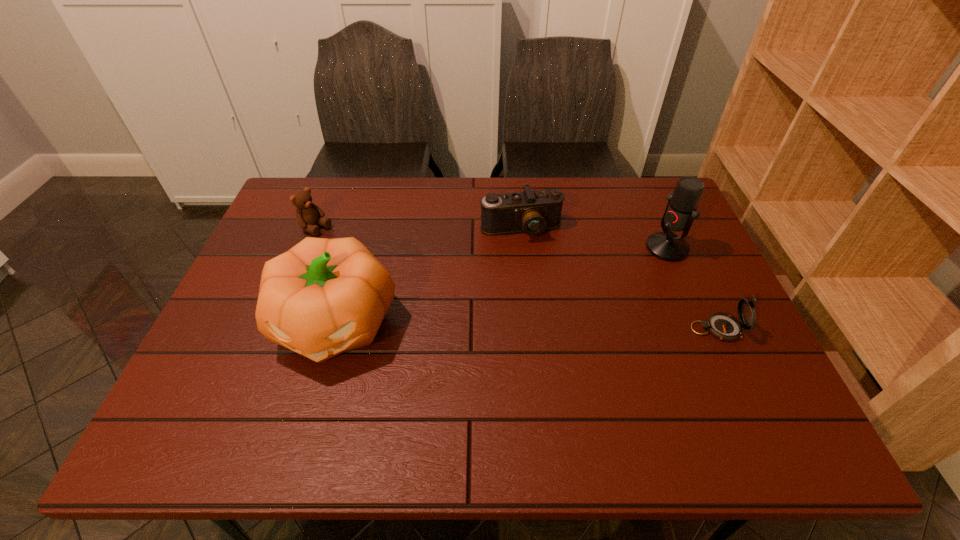
You are a GUI agent. You are given a task and a screenshot of the screen. Output one action in this format:
    pyautogui.click(x=<x>, y=<y>)
    Task: Click on the pumpkin
    This screenshot has height=540, width=960.
    Given the screenshot: What is the action you would take?
    pyautogui.click(x=323, y=297)

Find the location of `compass`. compass is located at coordinates (725, 327).

In order to click on microphone in this screenshot , I will do `click(680, 212)`.

Locate an element on the screen. The image size is (960, 540). camera is located at coordinates (532, 212).

Locate an element on the screen. teddy bear is located at coordinates (308, 214).

Identify the location of free space located 0.390m on the side of the microphone with the red ring. coord(538,306).

At what (x,y) coordinates should I click in order to perform the action: click on free space located 0.170m on the side of the microphone with the red ring. Please return your answer as a coordinate pair (x, y). The image size is (960, 540). Looking at the image, I should click on tap(605, 276).

The width and height of the screenshot is (960, 540). Identify the location of free space located 0.300m on the side of the microphone with the red ring. (566, 293).

The height and width of the screenshot is (540, 960). In order to click on vacant region located 0.400m on the lens of the third object from left to right in this screenshot , I will do `click(569, 357)`.

Where is `vacant point located 0.310m on the lens of the third object from left to right`? This screenshot has height=540, width=960. vacant point located 0.310m on the lens of the third object from left to right is located at coordinates (559, 327).